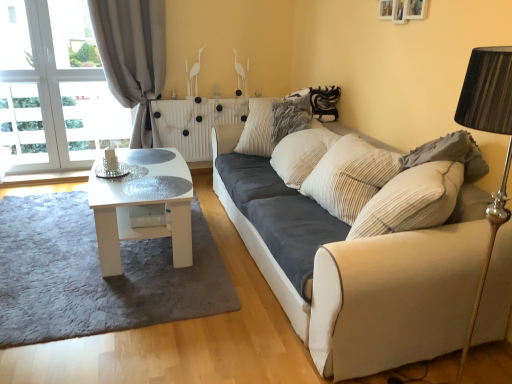
Where is `free point in front of white glossy coffee table at center`? The height and width of the screenshot is (384, 512). free point in front of white glossy coffee table at center is located at coordinates pyautogui.click(x=101, y=290).